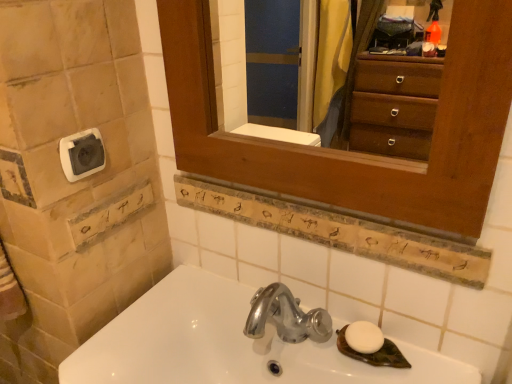
Locate an element on the screen. The height and width of the screenshot is (384, 512). vacant space that is to the left of white matte soap at lower right is located at coordinates (297, 336).